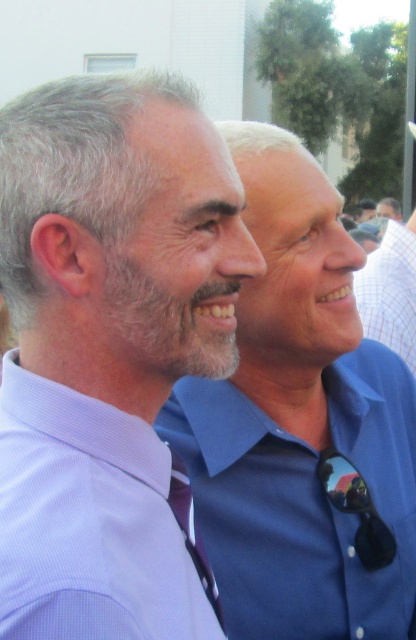
Question: Which point is farther from the camera taking this photo?

Choices:
 (A) (109, 541)
 (B) (188, 483)

Answer: (B)

Question: Is matte purple tie at left wider than matte blue shirt at center?

Choices:
 (A) no
 (B) yes

Answer: (A)

Question: Which point is farther from the camera taking this photo?

Choices:
 (A) (193, 552)
 (B) (393, 204)

Answer: (B)

Question: Can you confirm if matte purple tie at left is thinner than purple satin tie at center?

Choices:
 (A) yes
 (B) no

Answer: (B)

Question: Which point is closer to the camera?

Choices:
 (A) matte blue shirt at center
 (B) purple satin tie at center

Answer: (B)

Question: Does lavender textured dress shirt at left appear on the right side of purple satin tie at center?

Choices:
 (A) yes
 (B) no

Answer: (B)